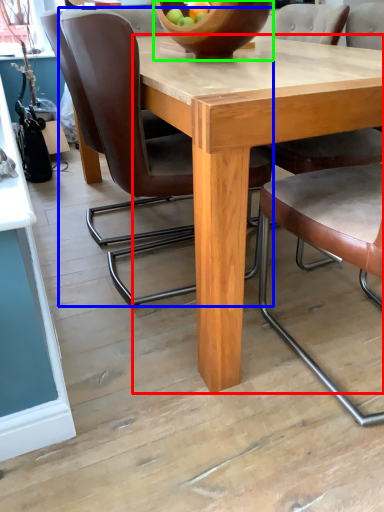
Question: Which object is positioned closest to round table (highlighted by a red box)? Select from chair (highlighted by a blue box) and bowl (highlighted by a green box).

Choices:
 (A) chair
 (B) bowl

Answer: (B)